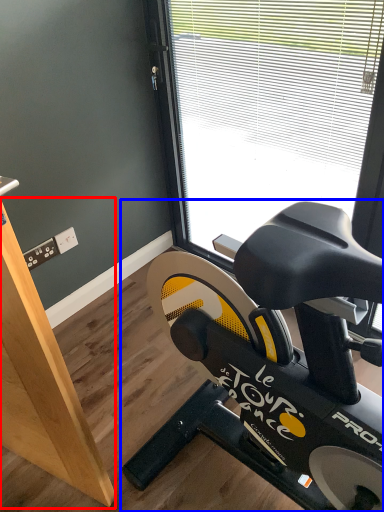
Question: Among these objects, which one is nearest to the camera, plywood (highlighted by a red box) or stationary bicycle (highlighted by a blue box)?

Choices:
 (A) plywood
 (B) stationary bicycle

Answer: (A)